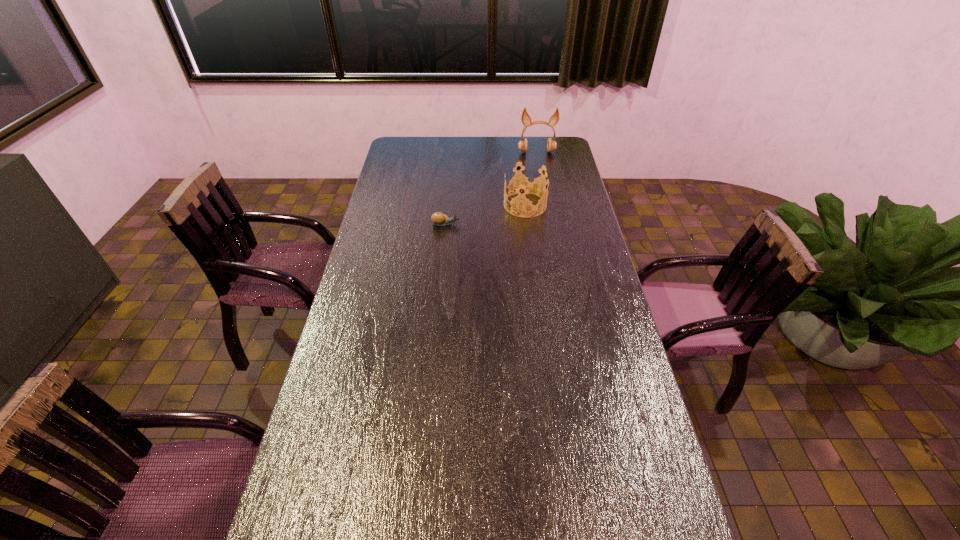
Image resolution: width=960 pixels, height=540 pixels. In order to click on the farthest object in this screenshot , I will do `click(525, 118)`.

The width and height of the screenshot is (960, 540). Find the location of `earphone`. earphone is located at coordinates (525, 118).

This screenshot has height=540, width=960. I want to click on the second tallest object, so click(x=526, y=185).

At what (x,y) coordinates should I click in order to perform the action: click on the second farthest object. Please return your answer as a coordinate pair (x, y). The width and height of the screenshot is (960, 540). Looking at the image, I should click on (526, 185).

Identify the location of the shortest object. The width and height of the screenshot is (960, 540). (439, 219).

Find the location of `the nearest object`. the nearest object is located at coordinates (439, 219).

At what (x,y) coordinates should I click in order to perform the action: click on vacant space located 0.280m on the front-facing side of the tallest object. Please return your answer as a coordinate pair (x, y). This screenshot has width=960, height=540. Looking at the image, I should click on (543, 187).

Find the location of `vacant space located on the front of the crown`. vacant space located on the front of the crown is located at coordinates (528, 225).

Locate an element on the screen. The width and height of the screenshot is (960, 540). vacant space located 0.390m on the front-facing side of the leftmost object is located at coordinates (559, 224).

At what (x,y) coordinates should I click in order to perform the action: click on object at the far edge. Please return your answer as a coordinate pair (x, y). Image resolution: width=960 pixels, height=540 pixels. Looking at the image, I should click on (525, 118).